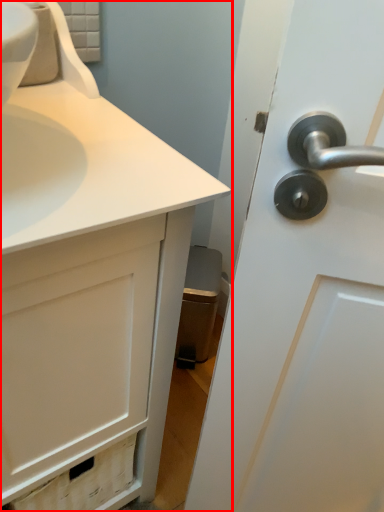
Question: From the image's perspective, what is the correct spatial positioning of bathroom cabinet (annotated by the red box) in reference to faucet?

Choices:
 (A) below
 (B) above

Answer: (A)